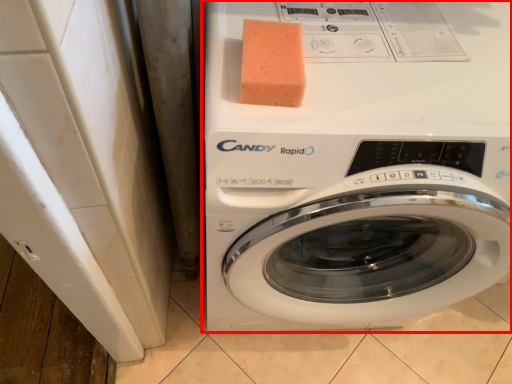
Question: From the image's perspective, considering the relative positions of washing machine (annotated by the red box) and soap in the image provided, where is washing machine (annotated by the red box) located with respect to the staircase?

Choices:
 (A) above
 (B) below

Answer: (B)